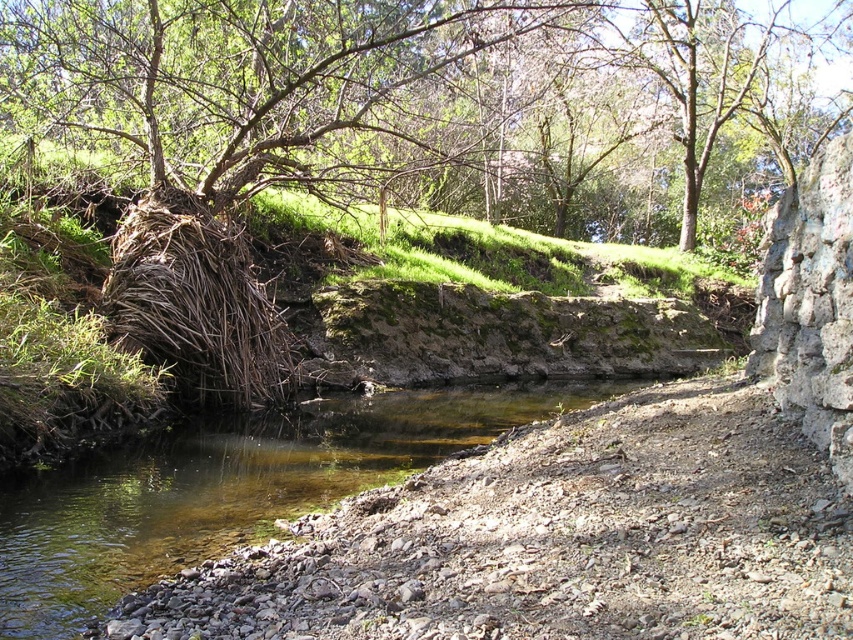
Question: Which point is farther to the camera?

Choices:
 (A) (326, 428)
 (B) (700, 148)

Answer: (B)

Question: Is green leafy tree at upper left to the left of clear water at bottom left from the viewer's perspective?

Choices:
 (A) no
 (B) yes

Answer: (A)

Question: Does green leafy tree at upper left appear over clear water at bottom left?

Choices:
 (A) yes
 (B) no

Answer: (A)

Question: Is green leafy tree at upper left bigger than clear water at bottom left?

Choices:
 (A) yes
 (B) no

Answer: (A)

Question: Which of the following is the closest to the observer?

Choices:
 (A) green leafy tree at upper left
 (B) clear water at bottom left

Answer: (B)